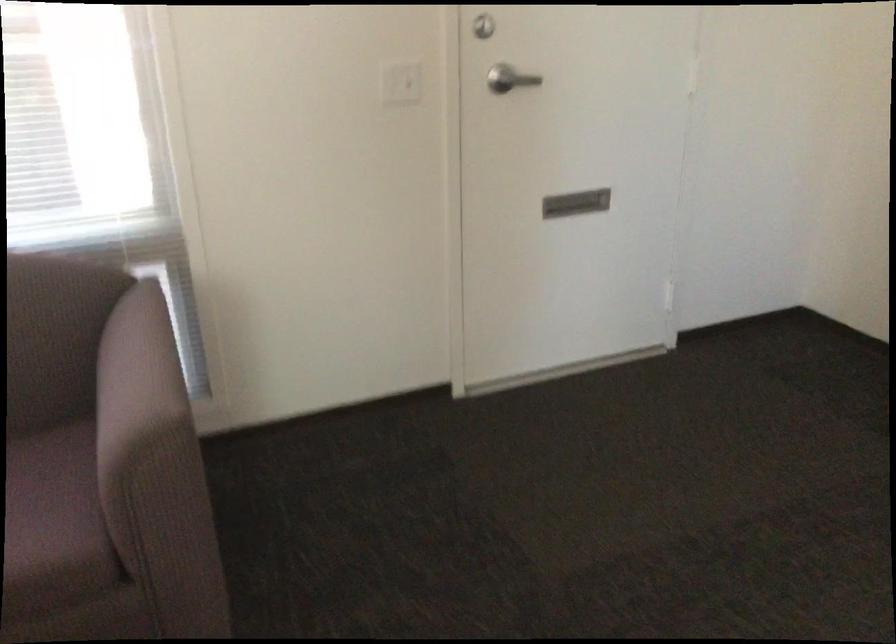
Find the location of a particular element. The image size is (896, 644). brown sofa sitting surface is located at coordinates (53, 520).